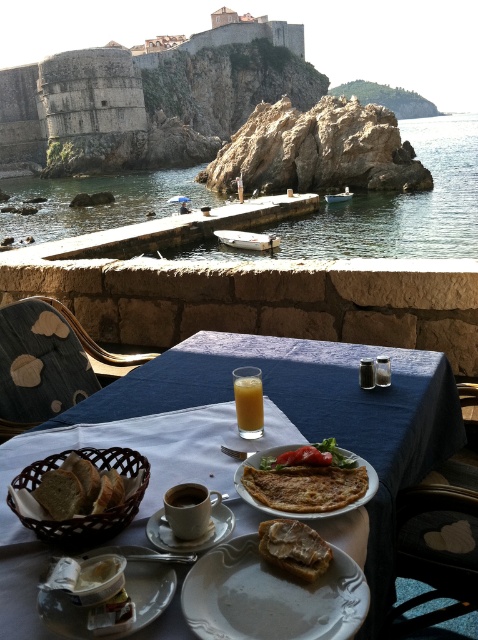
Is blue fabric table at center closer to the viewer compared to black fabric chair at lower right?

That is True.

Where is `blue fabric table at center`? The image size is (478, 640). blue fabric table at center is located at coordinates (312, 416).

How much distance is there between white bread at center and matte ceramic cup at center?

white bread at center is 9.70 inches away from matte ceramic cup at center.

Who is positioned more to the left, white bread at center or matte ceramic cup at center?

white bread at center is more to the left.

Which is behind, point (72, 508) or point (197, 522)?

The point (72, 508) is behind.

Where is `white bread at center`? white bread at center is located at coordinates (78, 488).

Between white bread at center and brown matte cup at center, which one appears on the right side from the viewer's perspective?

brown matte cup at center is more to the right.

Between white bread at center and brown matte cup at center, which one has more height?

With more height is white bread at center.

What do you see at coordinates (78, 488) in the screenshot? The height and width of the screenshot is (640, 478). I see `white bread at center` at bounding box center [78, 488].

Locate an element on the screen. Image resolution: width=478 pixels, height=640 pixels. white bread at center is located at coordinates (78, 488).